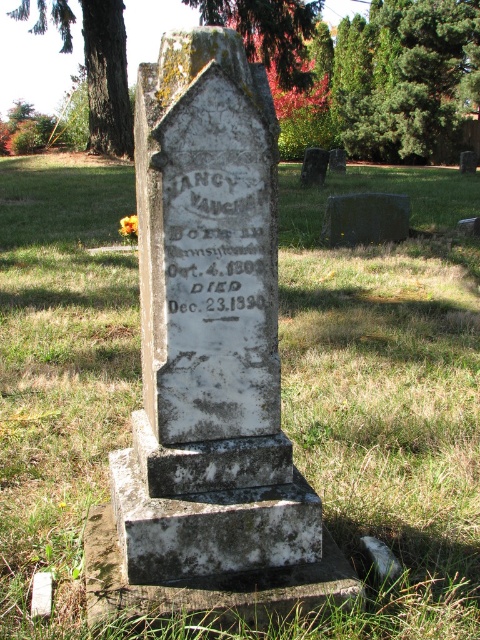
Does green leafy tree at upper center appear on the right side of black stone inscription at center?

Correct, you'll find green leafy tree at upper center to the right of black stone inscription at center.

In the scene shown: Does green leafy tree at upper center have a smaller size compared to black stone inscription at center?

Indeed, green leafy tree at upper center has a smaller size compared to black stone inscription at center.

Locate an element on the screen. Image resolution: width=480 pixels, height=640 pixels. green leafy tree at upper center is located at coordinates (406, 76).

Which is behind, point (169, 212) or point (95, 140)?

Point (95, 140)

Can you confirm if black stone inscription at center is thinner than smooth bark tree at upper left?

No, black stone inscription at center is not thinner than smooth bark tree at upper left.

The image size is (480, 640). What do you see at coordinates (218, 244) in the screenshot?
I see `black stone inscription at center` at bounding box center [218, 244].

I want to click on black stone inscription at center, so click(x=218, y=244).

Does black stone inscription at center have a greater width compared to green mossy tree at upper left?

In fact, black stone inscription at center might be narrower than green mossy tree at upper left.

In the scene shown: Between black stone inscription at center and green mossy tree at upper left, which one is positioned higher?

Positioned higher is green mossy tree at upper left.

Is point (240, 189) more distant than point (108, 115)?

No, it is not.

You are a GUI agent. You are given a task and a screenshot of the screen. Output one action in this format:
    pyautogui.click(x=<x>, y=<y>)
    Task: Click on the black stone inscription at center
    The height and width of the screenshot is (640, 480).
    Given the screenshot: What is the action you would take?
    pyautogui.click(x=218, y=244)